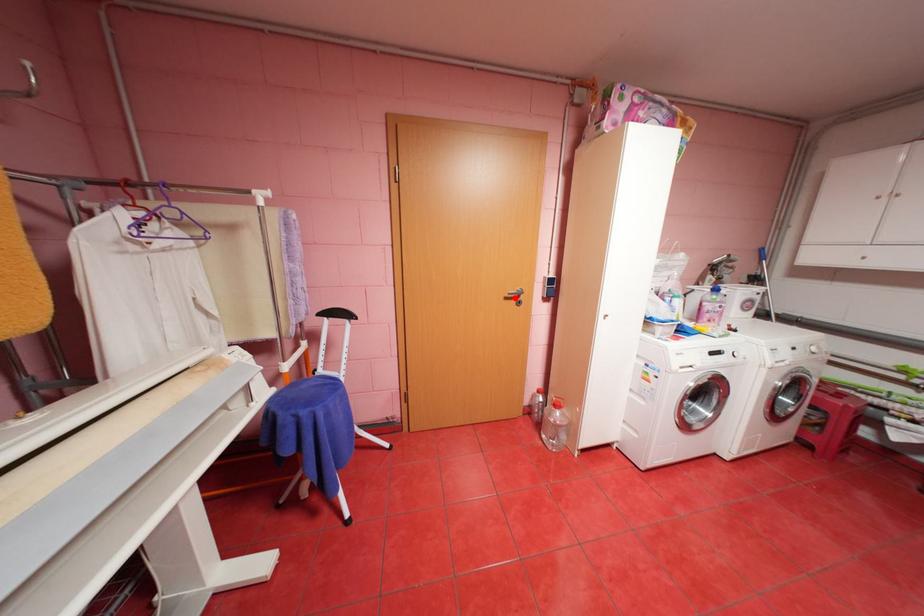
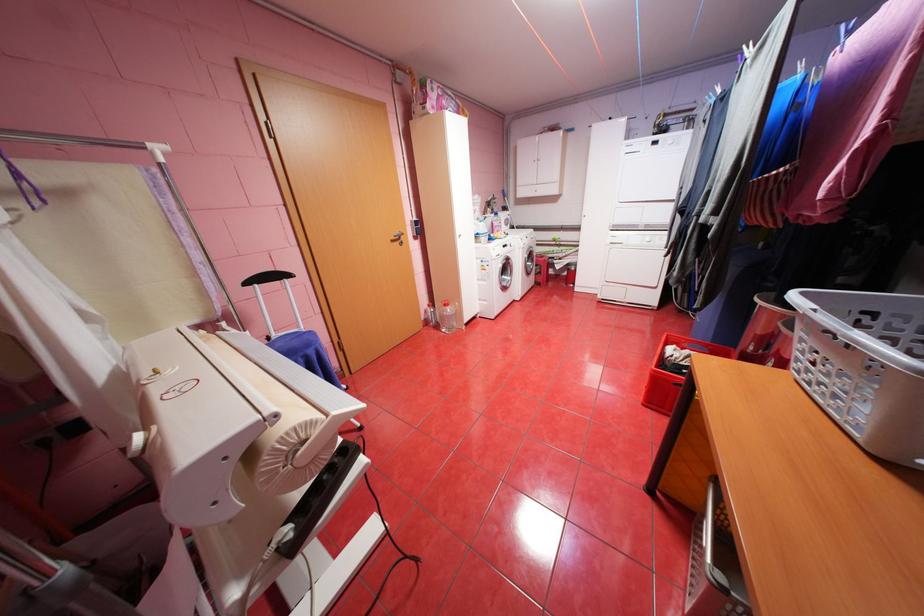
Find the pixel in the second image that matches the highlighted location in the first image.

(400, 241)